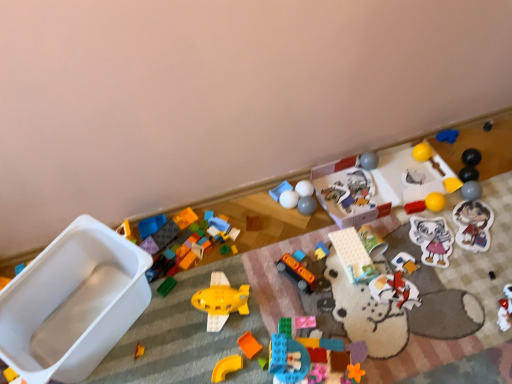
Find the location of `vacant space that's between yellow plastic curve at center, which ranks as the 21th toy in right-to-left order, and white plastic container at left, which is the 1th toy in left-to-right order`. vacant space that's between yellow plastic curve at center, which ranks as the 21th toy in right-to-left order, and white plastic container at left, which is the 1th toy in left-to-right order is located at coordinates (170, 349).